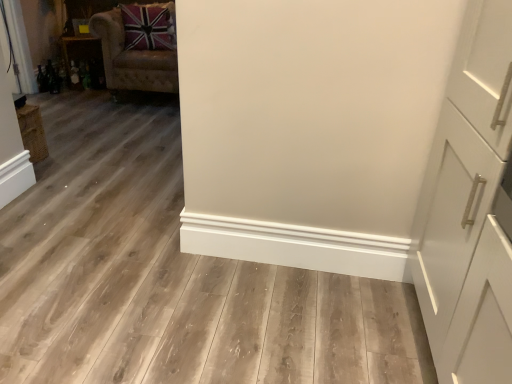
Question: Does point (146, 64) appear closer or farther from the camera than point (84, 38)?

Choices:
 (A) closer
 (B) farther

Answer: (A)

Question: In terms of width, does velvet beige armchair at upper left look wider or thinner when compared to wooden shelf at left?

Choices:
 (A) wide
 (B) thin

Answer: (A)

Question: From the image's perspective, is velvet beige armchair at upper left located above or below wooden shelf at left?

Choices:
 (A) below
 (B) above

Answer: (A)

Question: From the image's perspective, is wooden shelf at left above or below velvet beige armchair at upper left?

Choices:
 (A) above
 (B) below

Answer: (A)

Question: Considering the positions of wooden shelf at left and velvet beige armchair at upper left in the image, is wooden shelf at left bigger or smaller than velvet beige armchair at upper left?

Choices:
 (A) big
 (B) small

Answer: (B)

Question: In terms of height, does wooden shelf at left look taller or shorter compared to velvet beige armchair at upper left?

Choices:
 (A) short
 (B) tall

Answer: (A)

Question: Is point (91, 36) closer or farther from the camera than point (100, 14)?

Choices:
 (A) closer
 (B) farther

Answer: (B)